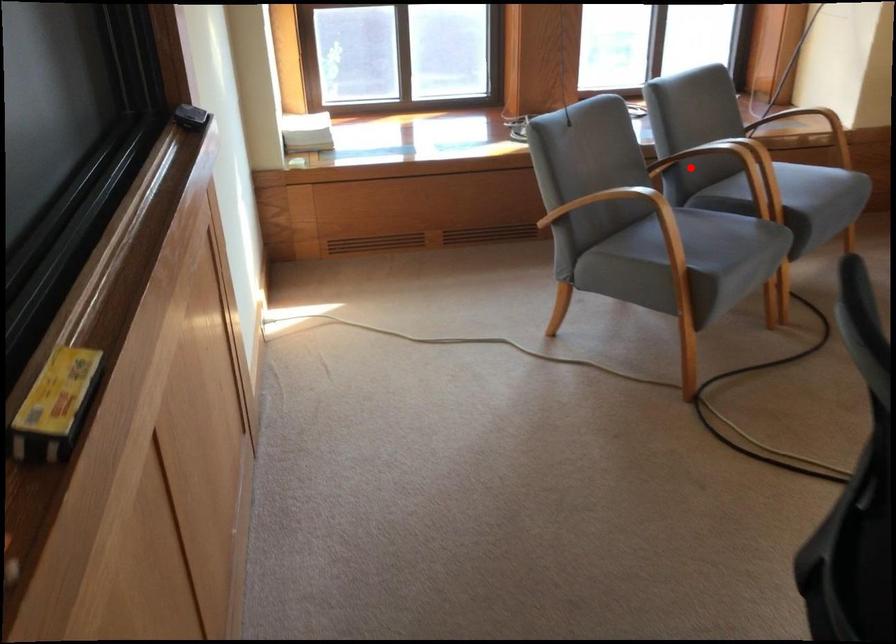
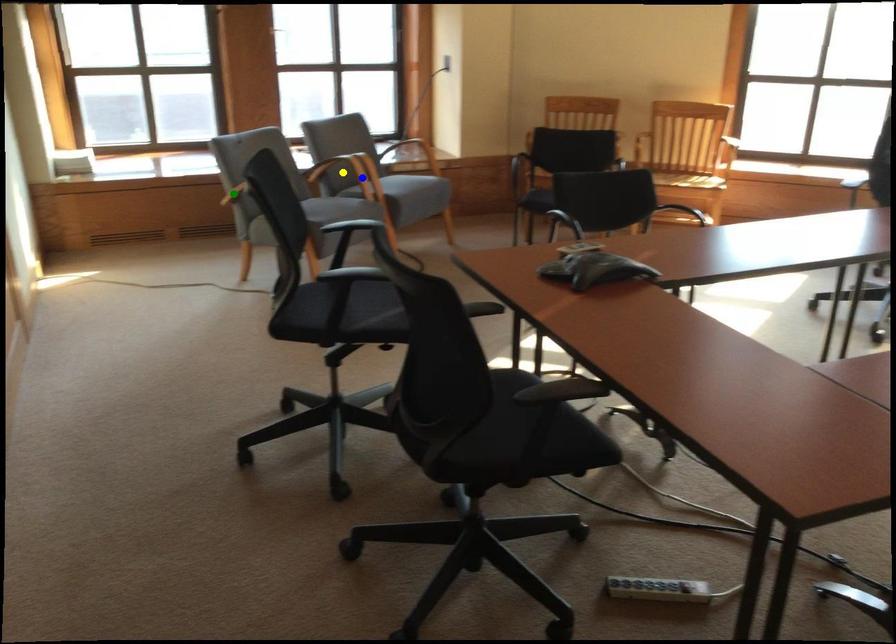
Question: I am providing you with two images of the same scene from different viewpoints. A red point is marked on the first image. You are given multiple points on the second image. Can you choose the point in image 2 that corresponds to the point in image 1?

Choices:
 (A) blue point
 (B) yellow point
 (C) green point

Answer: (B)